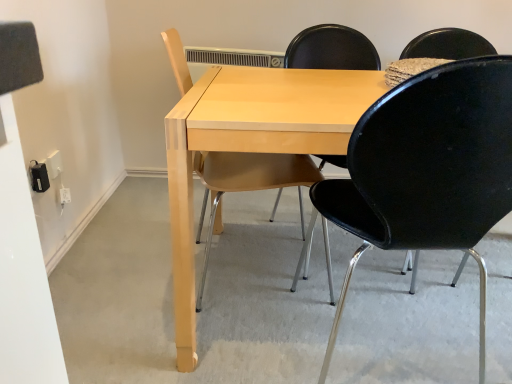
The image size is (512, 384). I want to click on space that is in front of light wood chair at center, the 2th chair positioned from the right, so click(207, 347).